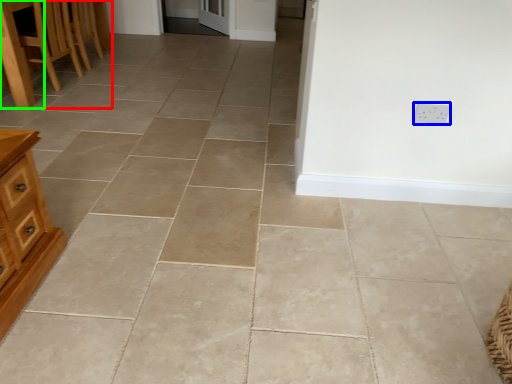
Question: Which is farther away from furniture (highlighted by a red box)? electric outlet (highlighted by a blue box) or table (highlighted by a green box)?

Choices:
 (A) electric outlet
 (B) table

Answer: (A)